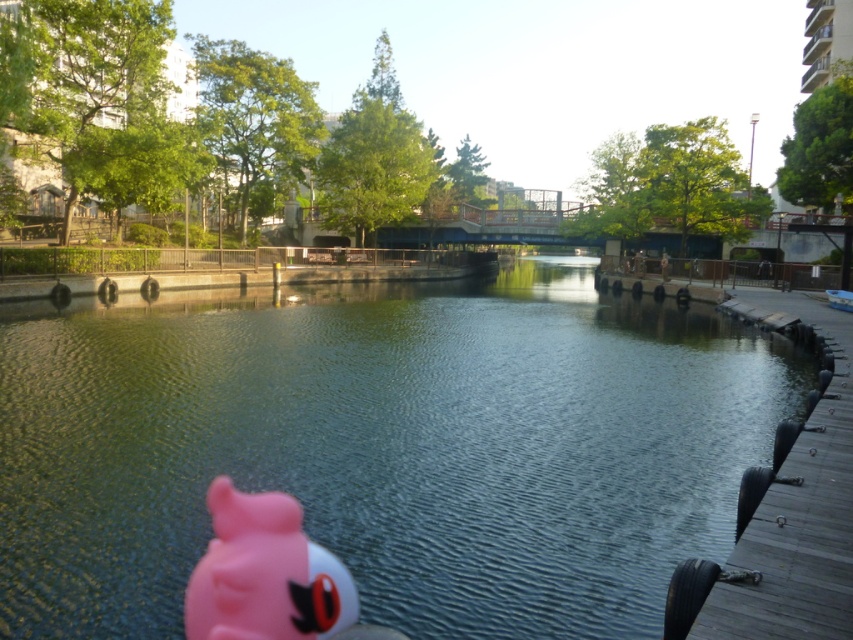
You are a child who wants to retrieve the pink rubber toy at lower left from the clear blue water at center. Considering the height difference between the two, can you reach the toy without getting wet?

The clear blue water at center is much taller than the pink rubber toy at lower left, so the water level is higher than the toy. This means the toy is submerged underwater, so you would need to wade into the water to retrieve it, getting wet in the process.

You are standing at the center of the image and want to walk towards the dark gray wooden dock at right. Based on the coordinates provided in the Objects Description, is the dock positioned more to the right or left of your current position?

The dark gray wooden dock at right is located at point coordinates with an x value of 0.803, which is closer to the right edge of the image. Since you are at the center, the dock is positioned more to the right of your current position.

In the scene shown: You are standing on the wooden dock on the right side of the canal. You want to throw a small pebble into the clear blue water at center. If you look down at the point marked by coordinates point (384,448), will you see that it is on the clear blue water at center?

Yes, the point (384,448) is on the clear blue water at center, so if you look down at that point, you will see it is on the clear blue water at center.